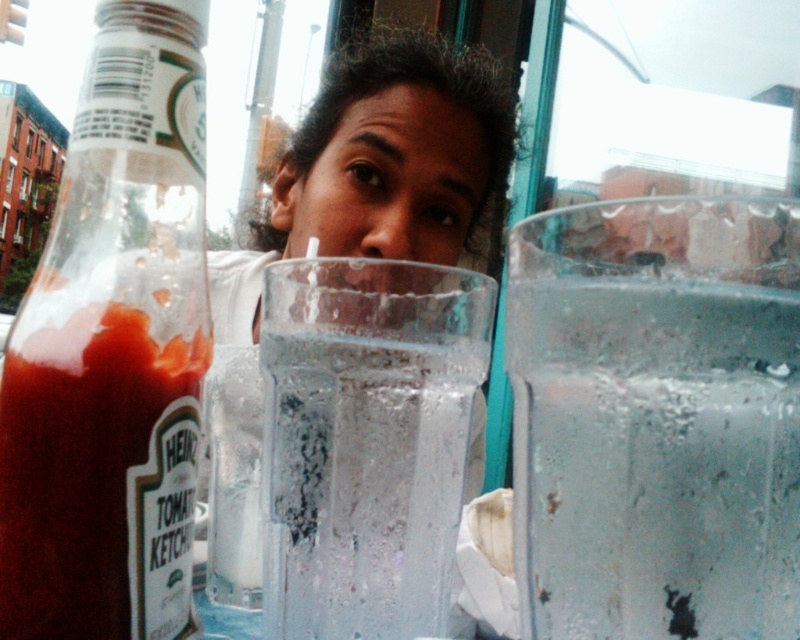
Can you confirm if clear glass ice at right is shorter than translucent glass bottle at left?

Yes.

Is clear glass ice at right bigger than translucent glass bottle at left?

Actually, clear glass ice at right might be smaller than translucent glass bottle at left.

Which is in front, point (716, 404) or point (72, 589)?

Point (716, 404)

Locate an element on the screen. Image resolution: width=800 pixels, height=640 pixels. clear glass ice at right is located at coordinates (656, 419).

Locate an element on the screen. Image resolution: width=800 pixels, height=640 pixels. translucent glass bottle at left is located at coordinates (113, 349).

Is translucent glass bottle at left shorter than clear glass water at center?

Incorrect, translucent glass bottle at left's height does not fall short of clear glass water at center's.

The image size is (800, 640). What do you see at coordinates (113, 349) in the screenshot? I see `translucent glass bottle at left` at bounding box center [113, 349].

The height and width of the screenshot is (640, 800). What are the coordinates of `translucent glass bottle at left` in the screenshot? It's located at (113, 349).

Can you confirm if clear glass ice at right is positioned above clear glass water at center?

Yes.

What do you see at coordinates (656, 419) in the screenshot?
I see `clear glass ice at right` at bounding box center [656, 419].

Describe the element at coordinates (656, 419) in the screenshot. I see `clear glass ice at right` at that location.

You are a GUI agent. You are given a task and a screenshot of the screen. Output one action in this format:
    pyautogui.click(x=<x>, y=<y>)
    Task: Click on the clear glass ice at right
    
    Given the screenshot: What is the action you would take?
    pyautogui.click(x=656, y=419)